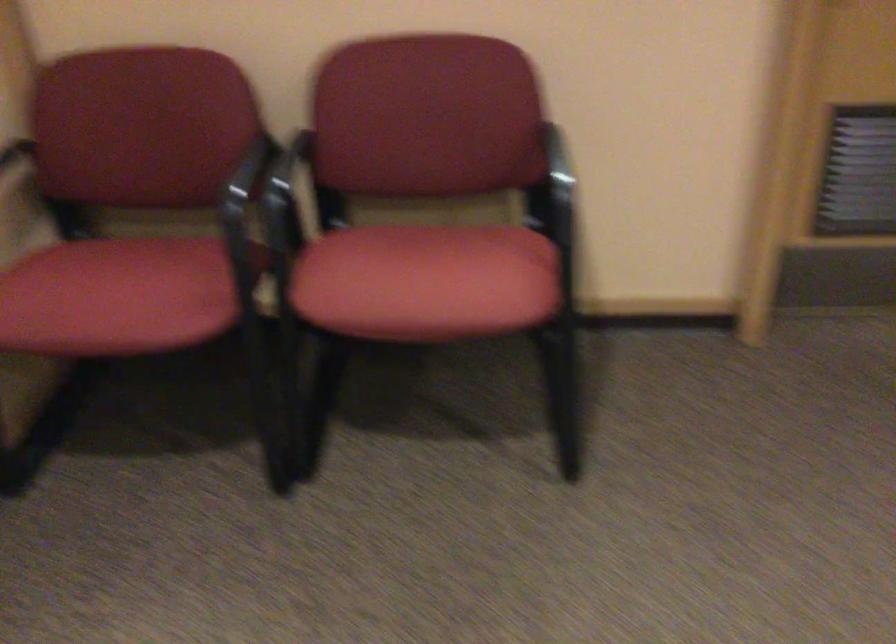
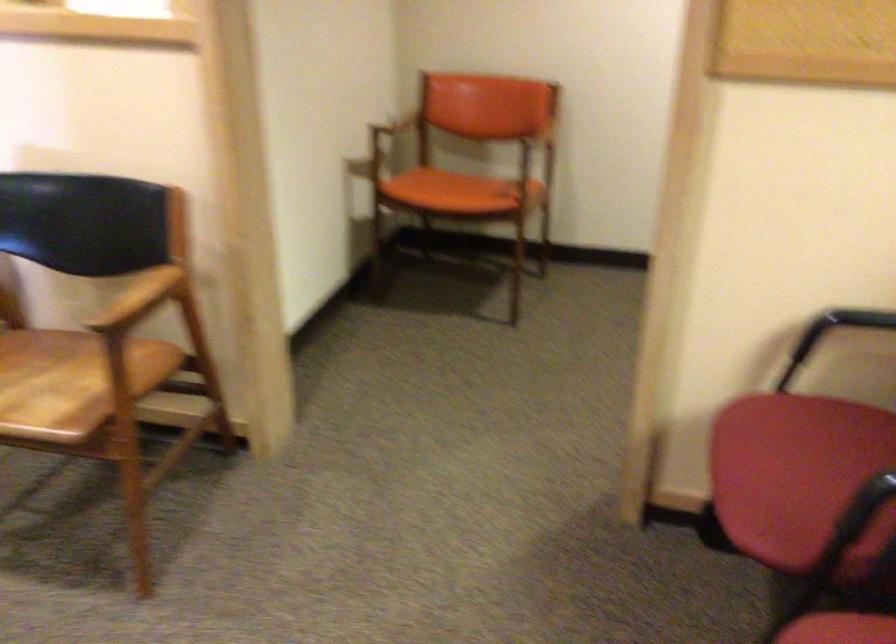
Find the pixel in the second image that matches (x=237, y=232) in the first image.

(865, 506)